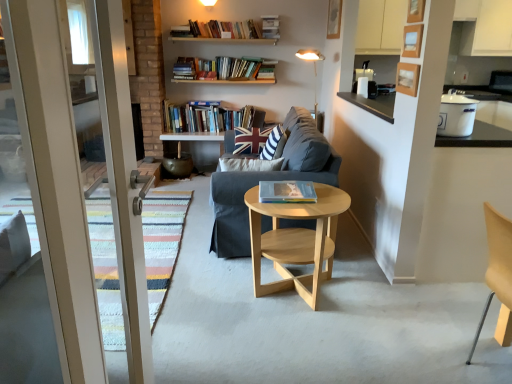
Identify the location of spots to the right of light wood/woodenobject at center. This screenshot has width=512, height=384. (372, 300).